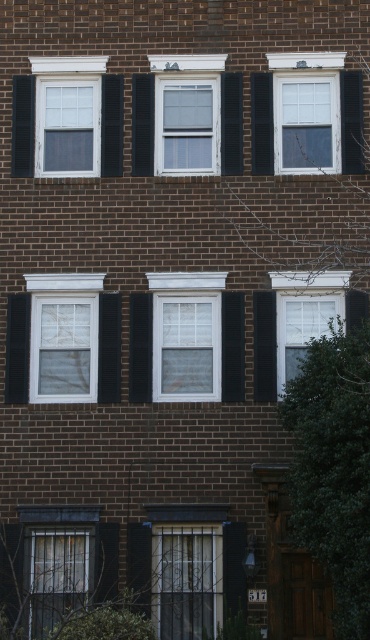
Question: Among these objects, which one is nearest to the camera?

Choices:
 (A) matte glass window at lower left
 (B) white matte window at upper center
 (C) clear glass window at upper center

Answer: (A)

Question: Considering the real-world distances, which object is farthest from the clear glass window at upper center?

Choices:
 (A) matte glass window at lower left
 (B) white matte window at upper center

Answer: (A)

Question: Does white matte window at upper center have a larger size compared to white matte window at center left?

Choices:
 (A) yes
 (B) no

Answer: (A)

Question: Where is white matte window at center right located in relation to clear glass window at upper center in the image?

Choices:
 (A) left
 (B) right

Answer: (A)

Question: Which is farther from the white matte window at center?

Choices:
 (A) white matte window at center right
 (B) clear glass window at upper center
 (C) white matte window at center left
 (D) white matte window at upper center

Answer: (B)

Question: Is clear glass window at upper center thinner than white glass window at center?

Choices:
 (A) yes
 (B) no

Answer: (B)